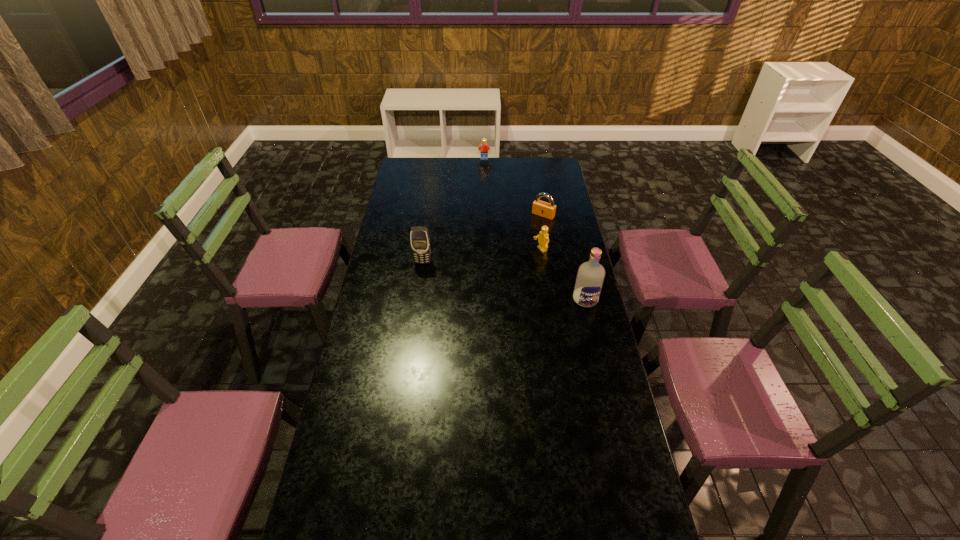
At what (x,y) coordinates should I click in order to perform the action: click on vacant area that lies between the fourth object from right to left and the third farthest object. Please return your answer as a coordinate pair (x, y). Image resolution: width=960 pixels, height=540 pixels. Looking at the image, I should click on (513, 204).

I want to click on empty space between the padlock and the rightmost object, so click(564, 257).

Where is `free space between the cellular telephone and the third farthest object`? free space between the cellular telephone and the third farthest object is located at coordinates (482, 256).

Locate an element on the screen. empty location between the second tallest object and the vodka is located at coordinates (504, 281).

Where is `vacant space that is in between the rightmost object and the nearer Lego`? vacant space that is in between the rightmost object and the nearer Lego is located at coordinates (563, 275).

Image resolution: width=960 pixels, height=540 pixels. I want to click on unoccupied position between the second farthest object and the second tallest object, so [x=483, y=239].

Find the location of a particular element. This screenshot has height=540, width=960. vacant space in between the fourth farthest object and the fourth nearest object is located at coordinates (483, 239).

Identify the location of unoccupied area between the right Lego and the second tallest object. The height and width of the screenshot is (540, 960). pos(482,256).

Select which object is the fourth closest to the nearest object. Please provide its 2D coordinates. Your answer should be formatted as a tuple, i.e. [(x, y)], where the tuple contains the x and y coordinates of a point satisfying the conditions above.

[(483, 148)]

This screenshot has height=540, width=960. I want to click on object that is the second closest to the rightmost object, so click(x=547, y=210).